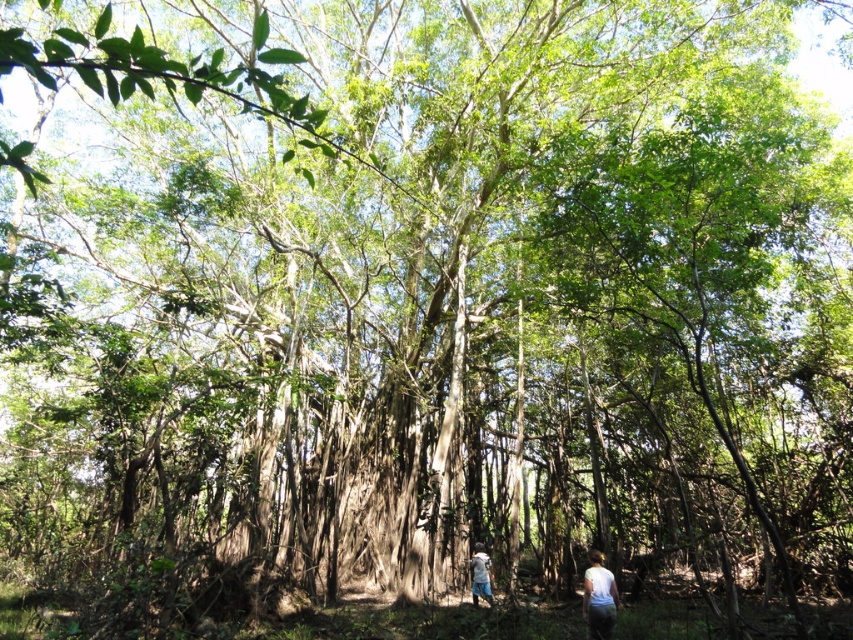
You are a photographer standing in the forest and want to capture both the point at location (611, 634) and the point at (486, 554) in your photo. Since you need to focus on the nearest object first, which point should you focus on?

Point (611, 634) is closer to the camera than point (486, 554), so you should focus on point (611, 634) first.

You are a hiker in the forest and you see both the white matte shirt at lower right and the white cotton shirt at lower center. Which shirt is closer to you?

The white matte shirt at lower right is closer to you because it is in front of the white cotton shirt at lower center.

You are a hiker carrying a backpack and need to move from the white cotton shirt at lower center to the white matte shirt at lower right. Given that your backpack is 1.8 meters wide, will you be able to move directly between them without adjusting your path?

The distance between the white matte shirt at lower right and white cotton shirt at lower center is 2.52 meters. Since your backpack is 1.8 meters wide, the space between them is sufficient for you to move directly without needing to adjust your path.